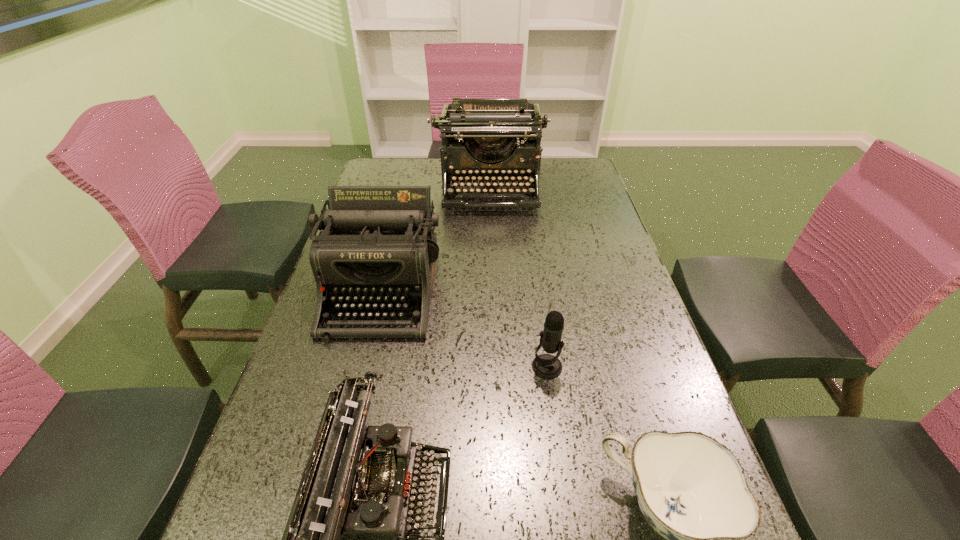
Image resolution: width=960 pixels, height=540 pixels. Find the location of `vacant space at the far edge of the desktop`. vacant space at the far edge of the desktop is located at coordinates (416, 180).

The width and height of the screenshot is (960, 540). Find the location of `free spot at the left edge of the desktop`. free spot at the left edge of the desktop is located at coordinates (331, 320).

The image size is (960, 540). What are the coordinates of `free location at the right edge` in the screenshot? It's located at (594, 197).

Identify the location of vacant area at the far left corner of the desktop. (384, 183).

This screenshot has width=960, height=540. Find the location of `free space at the far right corner of the desktop`. free space at the far right corner of the desktop is located at coordinates (555, 177).

I want to click on empty space that is in between the farthest object and the third nearest object, so click(x=518, y=278).

In order to click on empty space that is in between the farthest object and the microphone in this screenshot , I will do `click(518, 278)`.

Locate an element on the screen. This screenshot has height=540, width=960. vacant space in between the farthest typewriter and the microphone is located at coordinates (518, 278).

Locate an element on the screen. This screenshot has height=540, width=960. empty space that is in between the fourth nearest object and the microphone is located at coordinates pyautogui.click(x=465, y=328).

Locate which object is the closest to the chinaware. Please provide its 2D coordinates. Your answer should be formatted as a tuple, i.e. [(x, y)], where the tuple contains the x and y coordinates of a point satisfying the conditions above.

[(547, 366)]